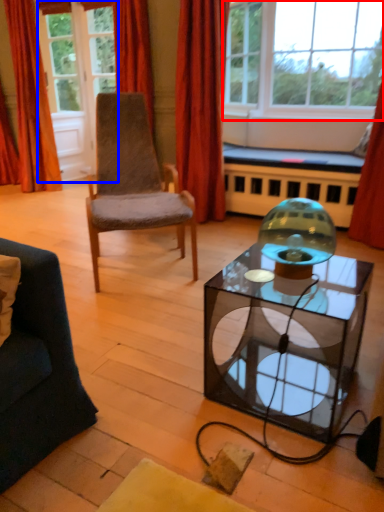
Question: Which point is closer to the camera, window (highlighted by a red box) or glass door (highlighted by a blue box)?

Choices:
 (A) window
 (B) glass door

Answer: (A)